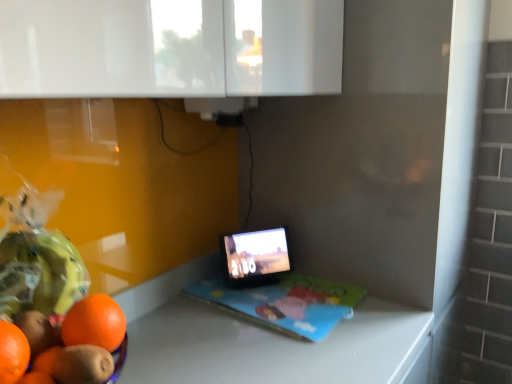
Question: From the image's perspective, would you say matte black laptop at center is shown under black glossy tablet at center?

Choices:
 (A) no
 (B) yes

Answer: (B)

Question: Is the position of matte black laptop at center more distant than that of black glossy tablet at center?

Choices:
 (A) yes
 (B) no

Answer: (B)

Question: From a real-world perspective, is matte black laptop at center physically below black glossy tablet at center?

Choices:
 (A) no
 (B) yes

Answer: (B)

Question: Considering the relative sizes of matte black laptop at center and black glossy tablet at center in the image provided, is matte black laptop at center shorter than black glossy tablet at center?

Choices:
 (A) no
 (B) yes

Answer: (B)

Question: Is matte black laptop at center thinner than black glossy tablet at center?

Choices:
 (A) no
 (B) yes

Answer: (A)

Question: Is matte black laptop at center at the right side of black glossy tablet at center?

Choices:
 (A) yes
 (B) no

Answer: (A)

Question: Is black glossy tablet at center positioned in front of matte black laptop at center?

Choices:
 (A) yes
 (B) no

Answer: (B)

Question: Considering the relative sizes of black glossy tablet at center and matte black laptop at center in the image provided, is black glossy tablet at center thinner than matte black laptop at center?

Choices:
 (A) yes
 (B) no

Answer: (A)

Question: Is black glossy tablet at center next to matte black laptop at center?

Choices:
 (A) yes
 (B) no

Answer: (A)

Question: From the image's perspective, is black glossy tablet at center over matte black laptop at center?

Choices:
 (A) no
 (B) yes

Answer: (B)

Question: Is matte black laptop at center located within black glossy tablet at center?

Choices:
 (A) yes
 (B) no

Answer: (B)

Question: From a real-world perspective, is black glossy tablet at center positioned over matte black laptop at center based on gravity?

Choices:
 (A) no
 (B) yes

Answer: (B)

Question: From the image's perspective, is matte black laptop at center located above or below black glossy tablet at center?

Choices:
 (A) above
 (B) below

Answer: (B)